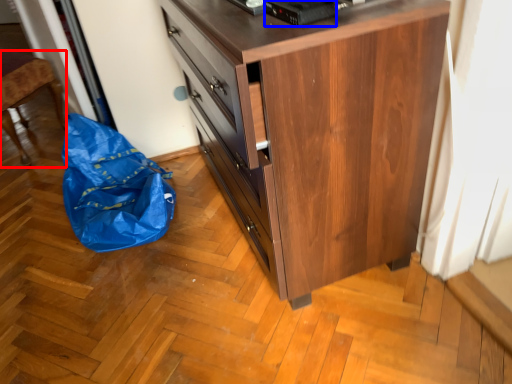
Question: Which point is further to the camera, furniture (highlighted by a red box) or appliance (highlighted by a blue box)?

Choices:
 (A) furniture
 (B) appliance

Answer: (A)